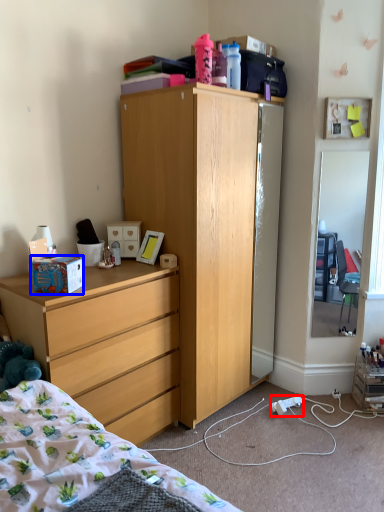
Question: Among these objects, which one is nearest to the camera, power outlet (highlighted by a red box) or box (highlighted by a blue box)?

Choices:
 (A) power outlet
 (B) box

Answer: (B)